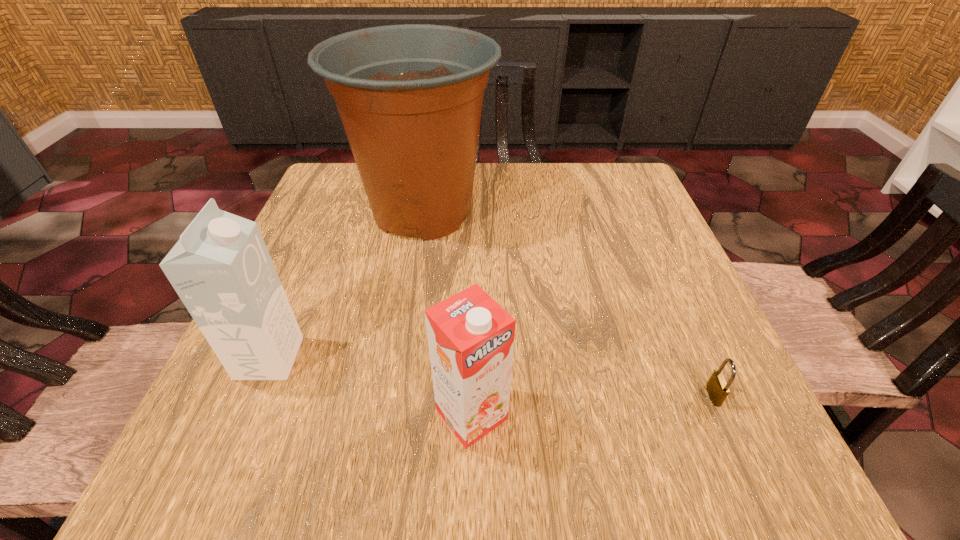
At what (x,y) coordinates should I click in order to perform the action: click on vacant space that satisfies the following two spatial constraints: 1. on the back side of the rightmost object; 2. on the front label of the third nearest object. Please return your answer as a coordinate pair (x, y). Looking at the image, I should click on (697, 358).